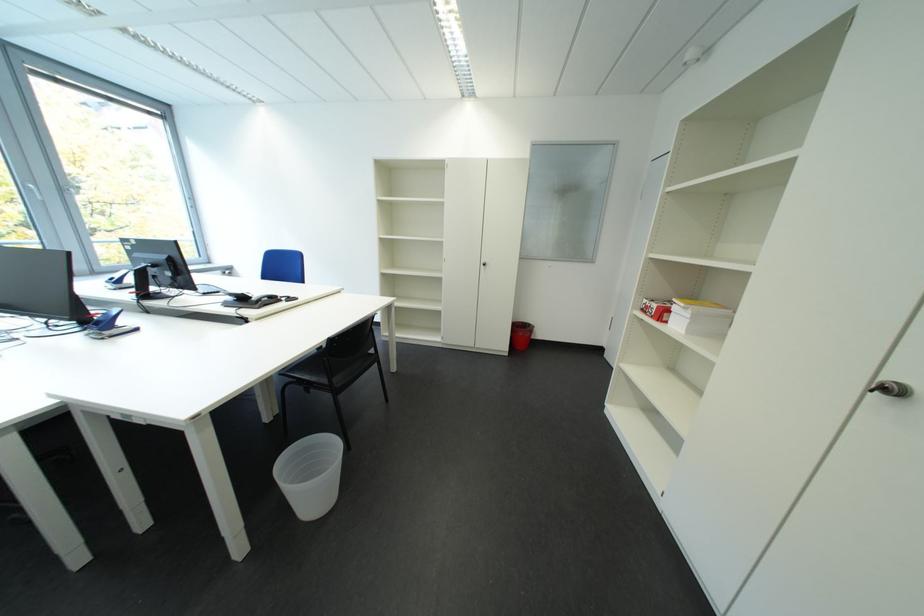
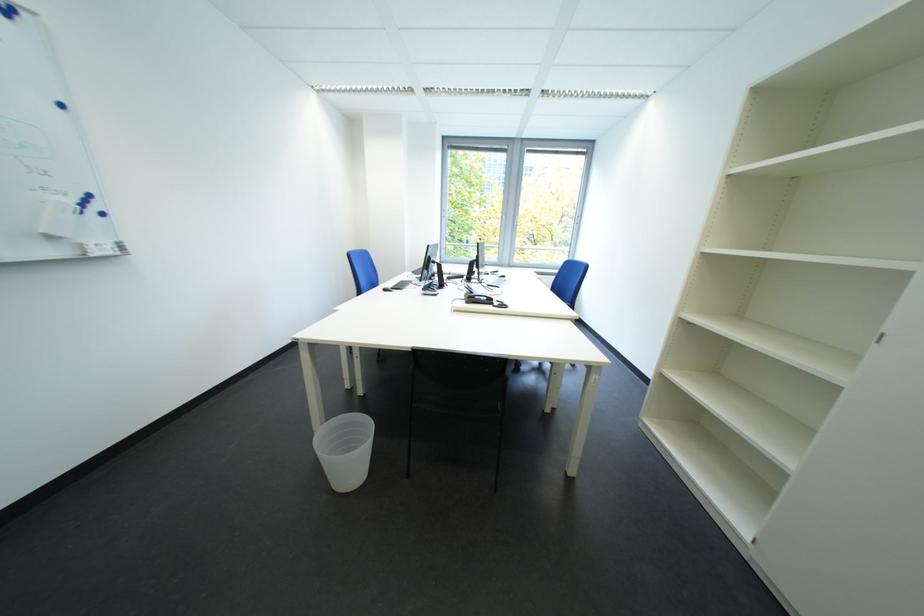
In the second image, find the point that corresponds to point (272, 302) in the first image.

(485, 300)